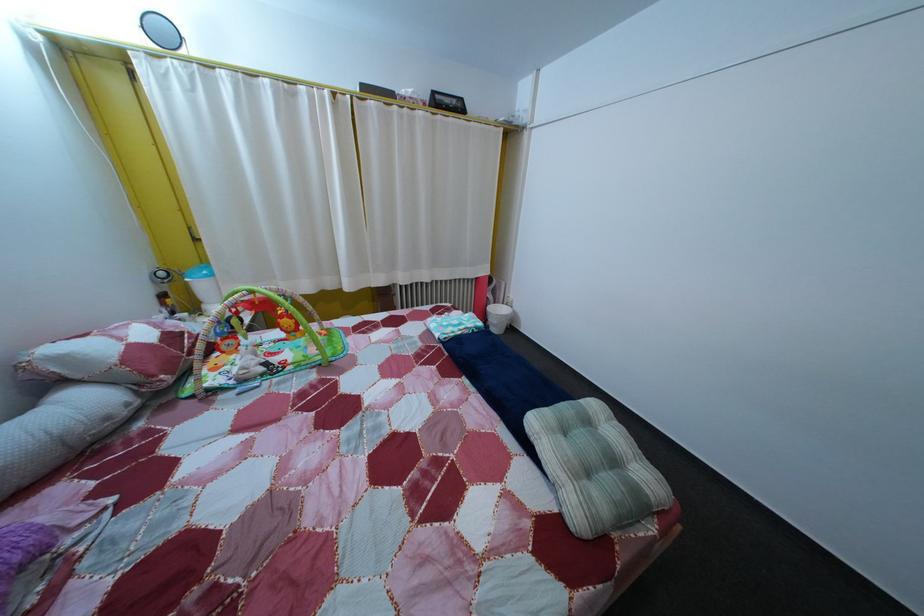
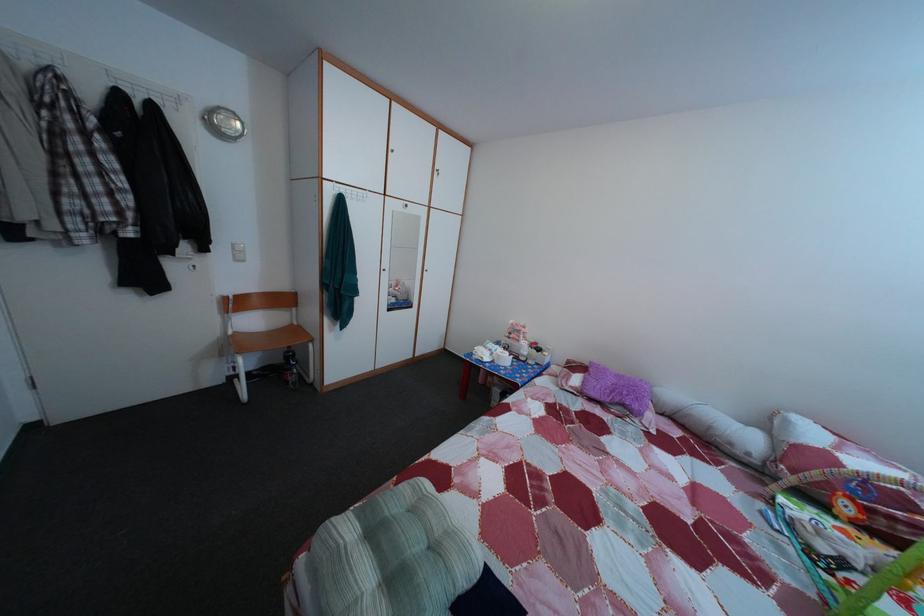
The point at (579, 460) is marked in the first image. Where is the corresponding point in the second image?

(440, 521)